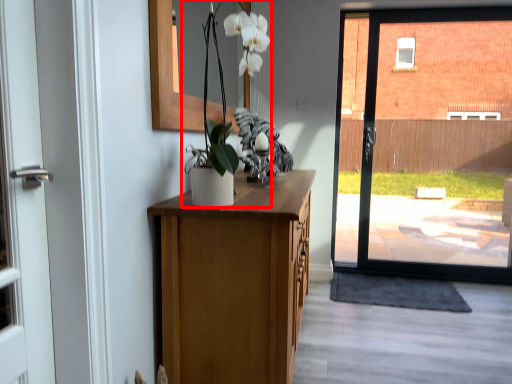
Question: In this image, where is floral arrangement (annotated by the red box) located relative to doormat?

Choices:
 (A) right
 (B) left

Answer: (B)